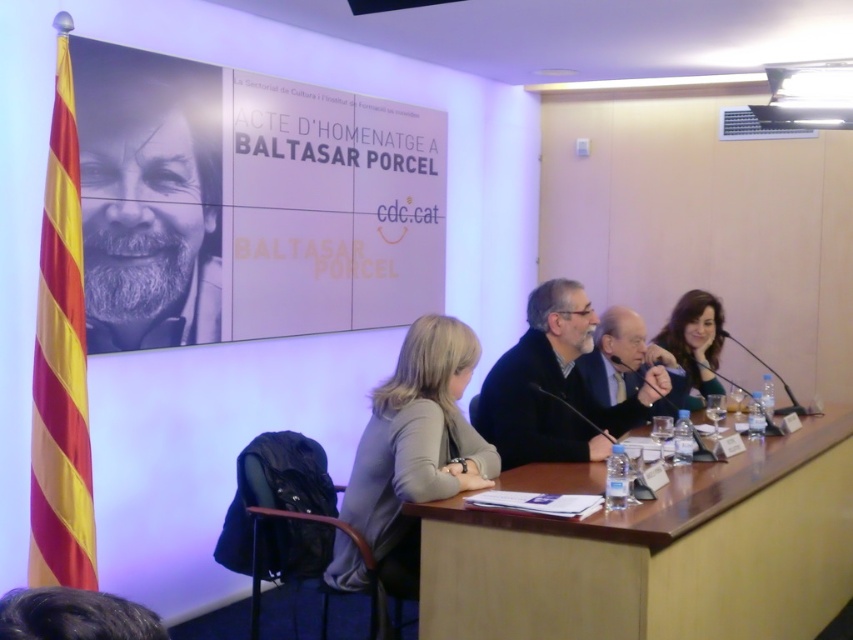
You are an attendee at the event and notice two items in the image. One is the black paper at upper left and the other is the dark brown hair at lower left. Which of these two items is located more to the left side of the image?

→ The black paper at upper left is positioned on the left side of dark brown hair at lower left, so the black paper at upper left is more to the left.